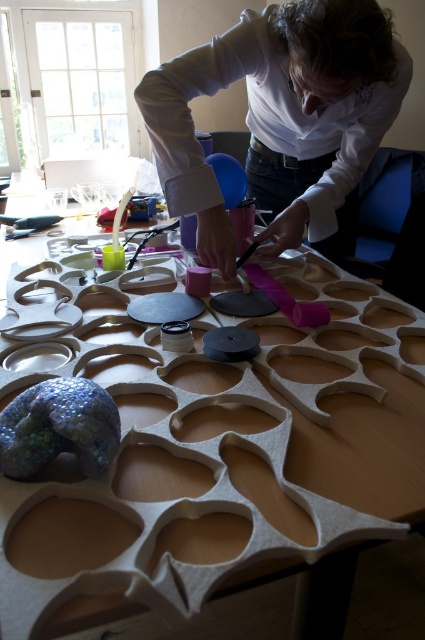
Question: Among these points, which one is nearest to the camera?

Choices:
 (A) (278, 540)
 (B) (299, 86)

Answer: (A)

Question: Which point is closer to the camera?

Choices:
 (A) white matte table at center
 (B) white matte shirt at upper center

Answer: (A)

Question: From the image, what is the correct spatial relationship of white matte table at center in relation to white matte shirt at upper center?

Choices:
 (A) left
 (B) right

Answer: (A)

Question: Is white matte table at center bigger than white matte shirt at upper center?

Choices:
 (A) no
 (B) yes

Answer: (B)

Question: Can you confirm if white matte table at center is bigger than white matte shirt at upper center?

Choices:
 (A) yes
 (B) no

Answer: (A)